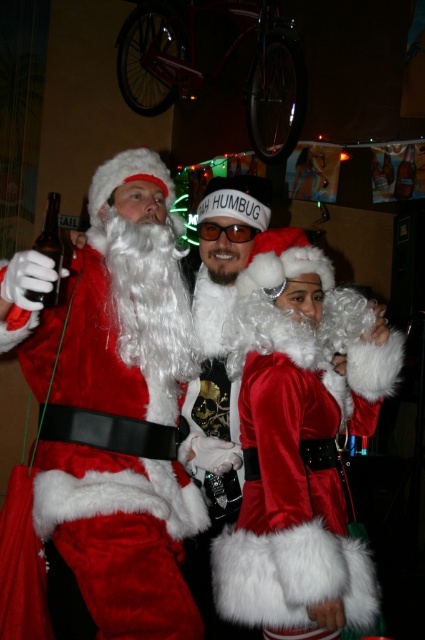
Who is taller, velvet santa claus at left or brown glass bottle at left?

With more height is velvet santa claus at left.

Is velvet santa claus at left positioned behind brown glass bottle at left?

No, velvet santa claus at left is in front of brown glass bottle at left.

Find the location of `velvet santa claus at left`. velvet santa claus at left is located at coordinates (104, 420).

Who is lower down, velvet santa suit at center or clear glass bottle at upper right?

velvet santa suit at center

Measure the distance between velvet santa suit at center and clear glass bottle at upper right.

velvet santa suit at center and clear glass bottle at upper right are 5.95 feet apart from each other.

Find the location of a particular element. The height and width of the screenshot is (640, 425). velvet santa suit at center is located at coordinates coord(221,292).

Which is more to the right, velvet santa suit at center or brown glass bottle at left?

velvet santa suit at center

Which is more to the left, velvet santa suit at center or brown glass bottle at left?

Positioned to the left is brown glass bottle at left.

Describe the element at coordinates (221, 292) in the screenshot. The width and height of the screenshot is (425, 640). I see `velvet santa suit at center` at that location.

Find the location of `velvet santa suit at center`. velvet santa suit at center is located at coordinates (221, 292).